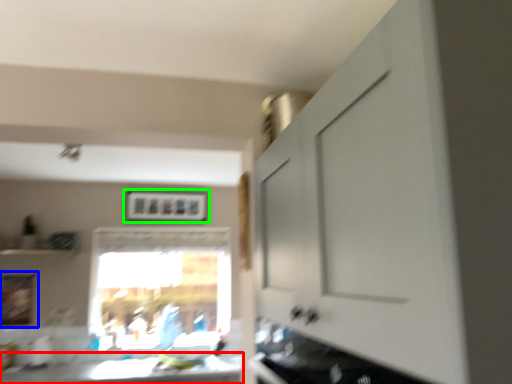
Question: Estimate the real-world distances between objects in this image. Which object is closer to counter top (highlighted by a red box), picture frame (highlighted by a blue box) or picture frame (highlighted by a green box)?

Choices:
 (A) picture frame
 (B) picture frame

Answer: (A)